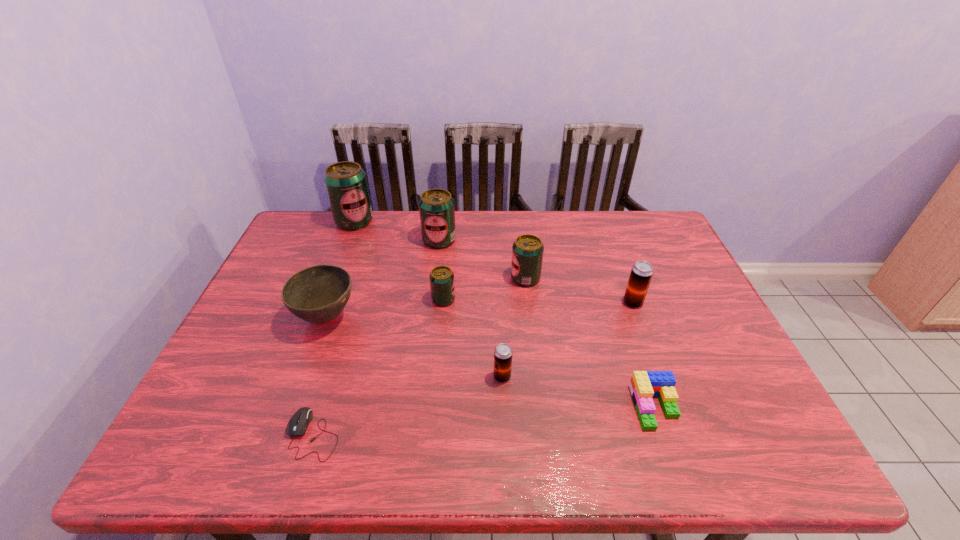
Find the location of a particular element. the biggest green beer can is located at coordinates (346, 184).

You are a GUI agent. You are given a task and a screenshot of the screen. Output one action in this format:
    pyautogui.click(x=<x>, y=<y>)
    Task: Click on the leftmost green beer can
    This screenshot has height=540, width=960.
    Given the screenshot: What is the action you would take?
    pyautogui.click(x=346, y=184)

At what (x,y) coordinates should I click in order to perform the action: click on the second tallest object. Please return your answer as a coordinate pair (x, y). This screenshot has width=960, height=540. Looking at the image, I should click on pyautogui.click(x=436, y=206).

Where is `the second biggest green beer can`? Image resolution: width=960 pixels, height=540 pixels. the second biggest green beer can is located at coordinates (436, 206).

The width and height of the screenshot is (960, 540). In order to click on the right black beer can in this screenshot , I will do `click(641, 274)`.

This screenshot has width=960, height=540. I want to click on the farther black beer can, so click(641, 274).

In order to click on the second smallest green beer can in this screenshot , I will do `click(527, 250)`.

At what (x,y) coordinates should I click in order to perform the action: click on the second nearest green beer can. Please return your answer as a coordinate pair (x, y). Looking at the image, I should click on (527, 250).

Locate an element on the screen. brown bowl is located at coordinates (318, 294).

The width and height of the screenshot is (960, 540). I want to click on the nearest green beer can, so click(x=442, y=286).